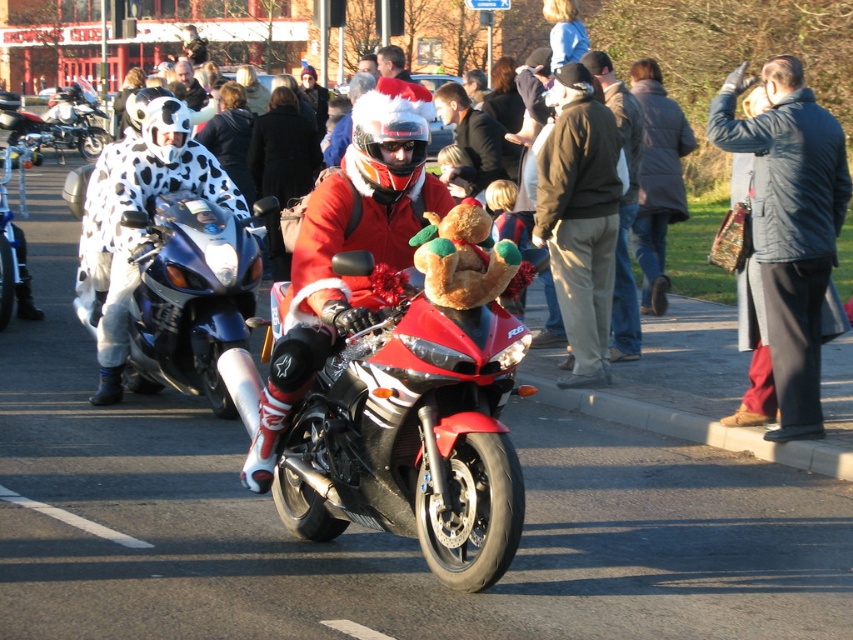
You are a photographer at the festive event and want to capture a photo of both the brown plush teddy bear at center and the santa hat at center. Based on their positions, which object should you focus on first to ensure both are in frame?

The brown plush teddy bear at center is positioned on the right side of the santa hat at center, so you should focus on the santa hat at center first to ensure both are in frame.

You are a fashion designer observing the festive street scene. You notice two jackets in the crowd. The first is a dark blue quilted jacket at upper right and the second is a dark gray jacket at center. Which jacket has a shorter length?

The dark blue quilted jacket at upper right is shorter than the dark gray jacket at center, so the dark blue quilted jacket at upper right has the shorter length.

You are a photographer trying to capture both the dark blue quilted jacket at upper right and the dark gray jacket at center in a single shot. Which jacket should you focus on first to ensure both are in frame?

You should focus on the dark gray jacket at center first because it is further away from the viewer than the dark blue quilted jacket at upper right, allowing you to adjust the camera angle to include both.